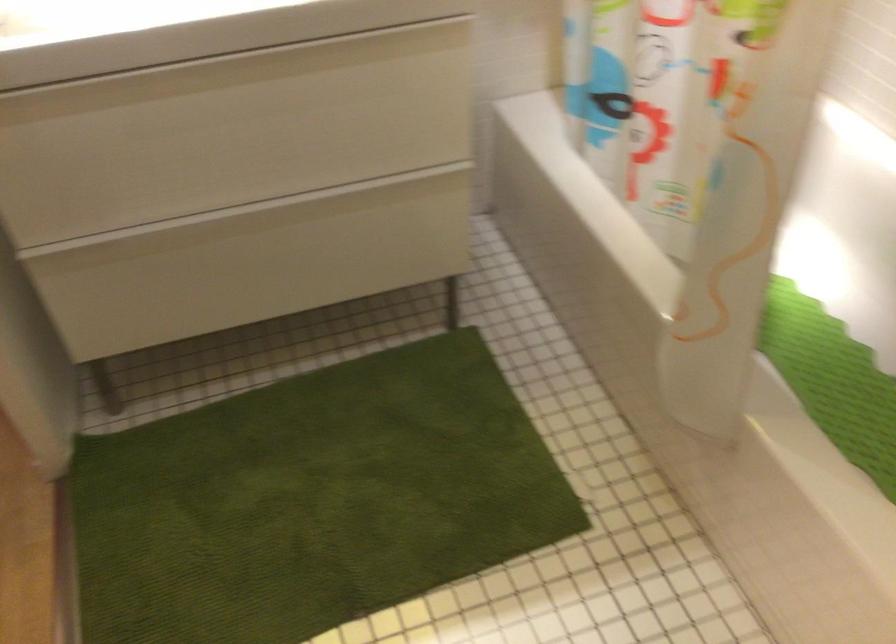
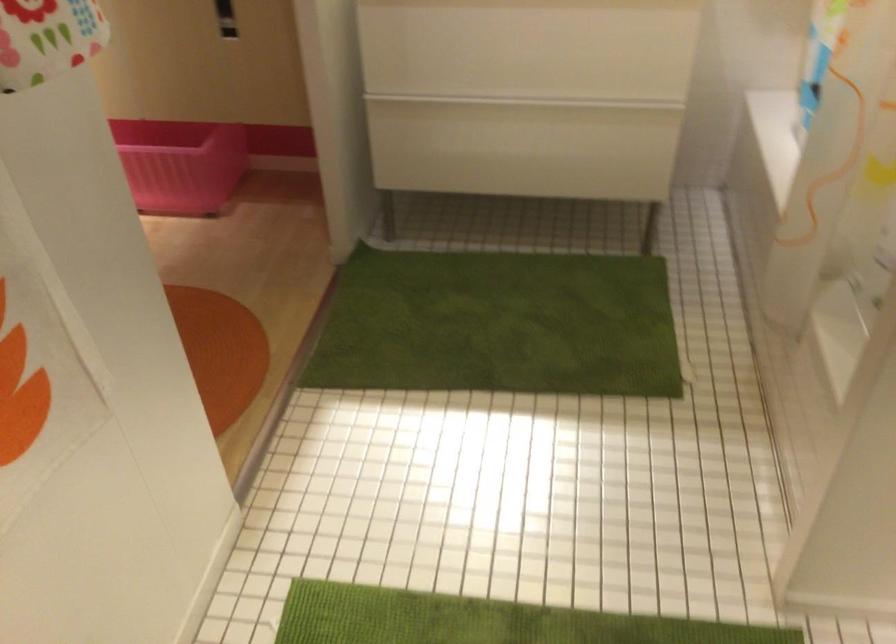
Question: The images are taken continuously from a first-person perspective. In which direction is your viewpoint rotating?

Choices:
 (A) Left
 (B) Right
 (C) Up
 (D) Down

Answer: (A)